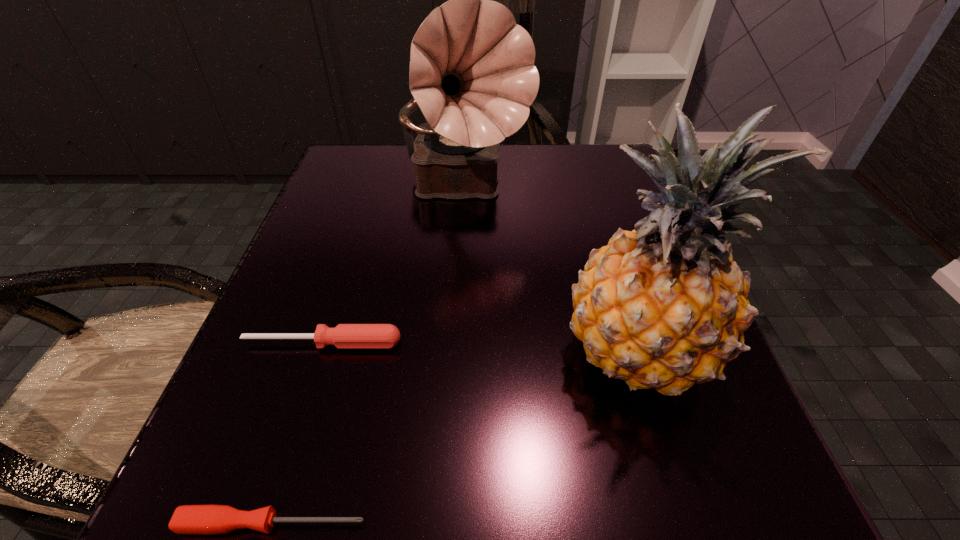
Locate an element on the screen. The width and height of the screenshot is (960, 540). object present at the far edge is located at coordinates (472, 74).

This screenshot has height=540, width=960. Find the location of `object at the near edge`. object at the near edge is located at coordinates (188, 519).

What are the coordinates of `object at the right edge` in the screenshot? It's located at (664, 306).

The width and height of the screenshot is (960, 540). I want to click on object at the near left corner, so click(x=188, y=519).

The height and width of the screenshot is (540, 960). In the image, there is a desktop. In order to click on vacant space at the far edge in this screenshot , I will do `click(529, 166)`.

The width and height of the screenshot is (960, 540). In the image, there is a desktop. What are the coordinates of `free space at the near edge` in the screenshot? It's located at (541, 534).

In the image, there is a desktop. What are the coordinates of `blank space at the left edge` in the screenshot? It's located at (276, 443).

Locate an element on the screen. This screenshot has width=960, height=540. vacant region at the right edge of the desktop is located at coordinates (573, 218).

What are the coordinates of `vacant region at the far left corner of the desktop` in the screenshot? It's located at (403, 170).

This screenshot has height=540, width=960. Find the location of `vacant space at the near left corner of the desktop`. vacant space at the near left corner of the desktop is located at coordinates (200, 456).